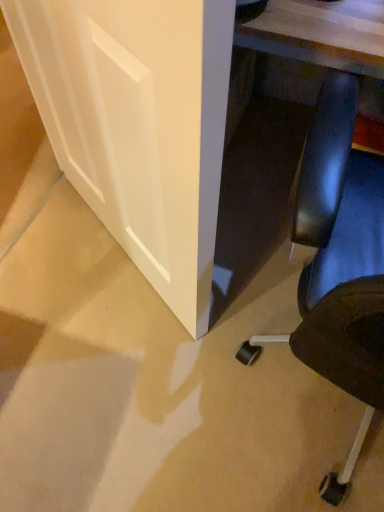
Question: Looking at the image, does white matte door at lower left seem bigger or smaller compared to black leather chair at lower right?

Choices:
 (A) big
 (B) small

Answer: (B)

Question: Visually, is white matte door at lower left positioned to the left or to the right of black leather chair at lower right?

Choices:
 (A) left
 (B) right

Answer: (A)

Question: Is white matte door at lower left spatially inside black leather chair at lower right, or outside of it?

Choices:
 (A) inside
 (B) outside

Answer: (B)

Question: Is black leather chair at lower right inside the boundaries of white matte door at lower left, or outside?

Choices:
 (A) inside
 (B) outside

Answer: (B)

Question: In terms of size, does black leather chair at lower right appear bigger or smaller than white matte door at lower left?

Choices:
 (A) big
 (B) small

Answer: (A)

Question: Is point (355, 348) positioned closer to the camera than point (62, 38)?

Choices:
 (A) farther
 (B) closer

Answer: (B)

Question: In terms of height, does black leather chair at lower right look taller or shorter compared to white matte door at lower left?

Choices:
 (A) short
 (B) tall

Answer: (B)